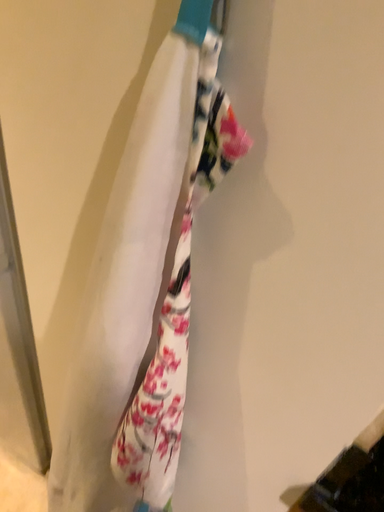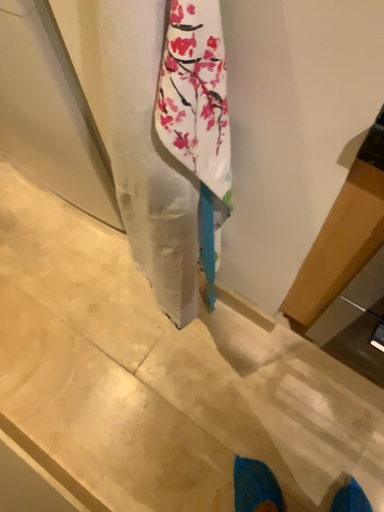
Question: Which way did the camera rotate in the video?

Choices:
 (A) rotated upward
 (B) rotated downward

Answer: (B)